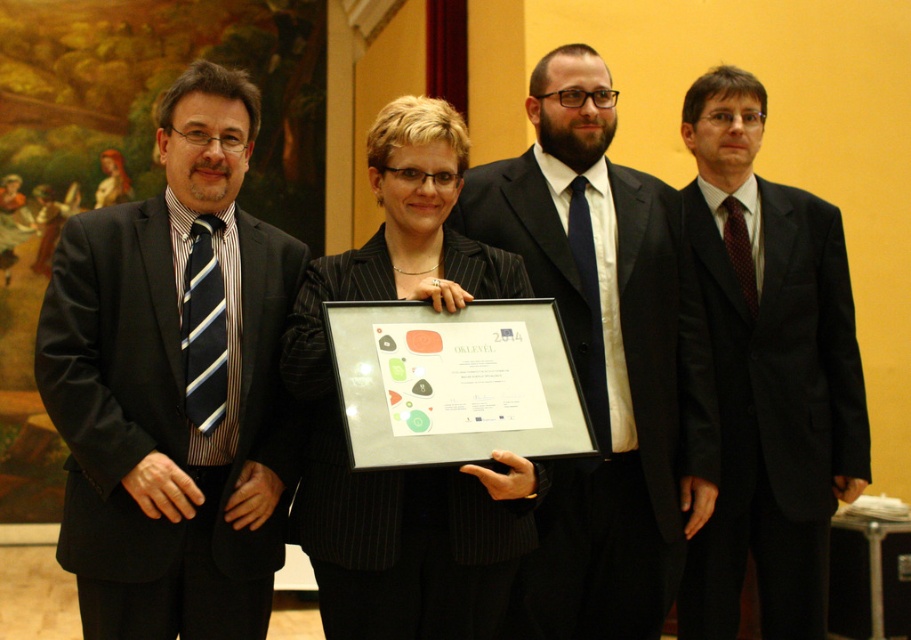
Does matte black suit at center have a smaller size compared to black satin suit at right?

No.

Is matte black suit at center further to camera compared to black satin suit at right?

No, it is in front of black satin suit at right.

Is point (497, 230) less distant than point (737, 547)?

Yes, point (497, 230) is closer to viewer.

I want to click on matte black suit at center, so click(x=602, y=356).

Consider the image. Is matte black suit at left in front of black pinstripe suit at center?

No.

Who is lower down, matte black suit at left or black pinstripe suit at center?

black pinstripe suit at center

Locate an element on the screen. matte black suit at left is located at coordinates (173, 385).

Image resolution: width=911 pixels, height=640 pixels. Find the location of `matte black suit at left`. matte black suit at left is located at coordinates (173, 385).

Does matte black suit at left come behind black satin suit at right?

No, matte black suit at left is in front of black satin suit at right.

Does matte black suit at left appear on the left side of black satin suit at right?

Indeed, matte black suit at left is positioned on the left side of black satin suit at right.

Locate an element on the screen. Image resolution: width=911 pixels, height=640 pixels. matte black suit at left is located at coordinates (173, 385).